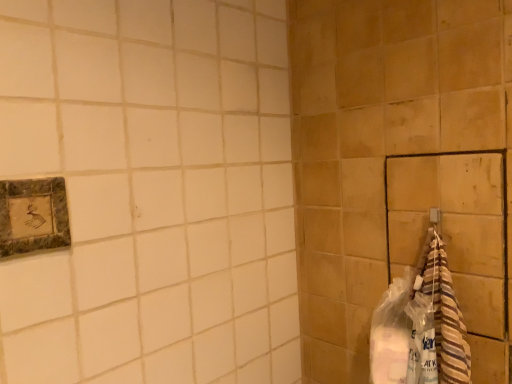
Question: In terms of height, does marble-like stone picture frame at upper left look taller or shorter compared to striped towel at right?

Choices:
 (A) short
 (B) tall

Answer: (A)

Question: Which is correct: marble-like stone picture frame at upper left is inside striped towel at right, or outside of it?

Choices:
 (A) outside
 (B) inside

Answer: (A)

Question: Visually, is marble-like stone picture frame at upper left positioned to the left or to the right of striped towel at right?

Choices:
 (A) right
 (B) left

Answer: (B)

Question: Relative to marble-like stone picture frame at upper left, is striped towel at right in front or behind?

Choices:
 (A) behind
 (B) front

Answer: (A)

Question: Which is correct: striped towel at right is inside marble-like stone picture frame at upper left, or outside of it?

Choices:
 (A) inside
 (B) outside

Answer: (B)

Question: Considering the positions of striped towel at right and marble-like stone picture frame at upper left in the image, is striped towel at right bigger or smaller than marble-like stone picture frame at upper left?

Choices:
 (A) small
 (B) big

Answer: (B)

Question: Considering the relative positions of striped towel at right and marble-like stone picture frame at upper left in the image provided, is striped towel at right to the left or to the right of marble-like stone picture frame at upper left?

Choices:
 (A) left
 (B) right

Answer: (B)